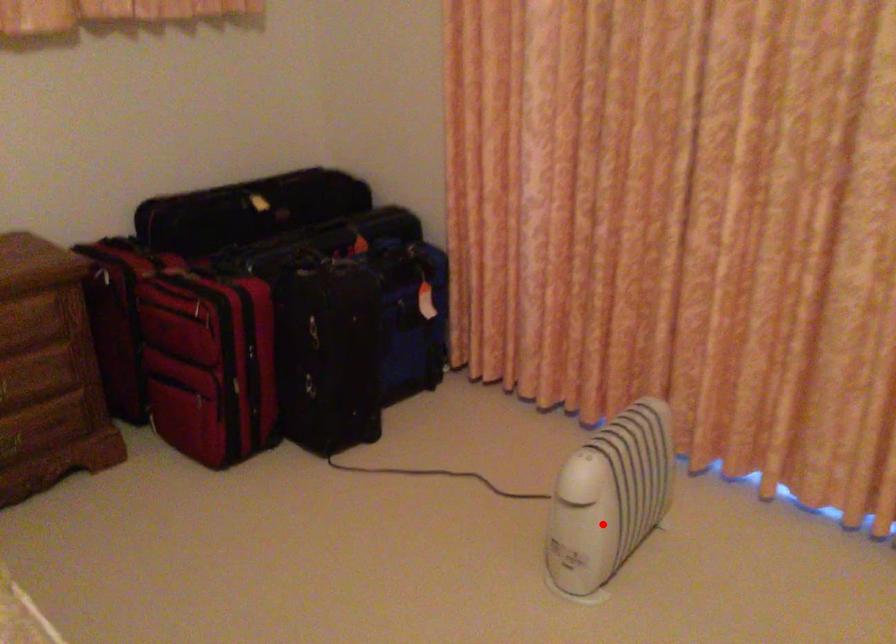
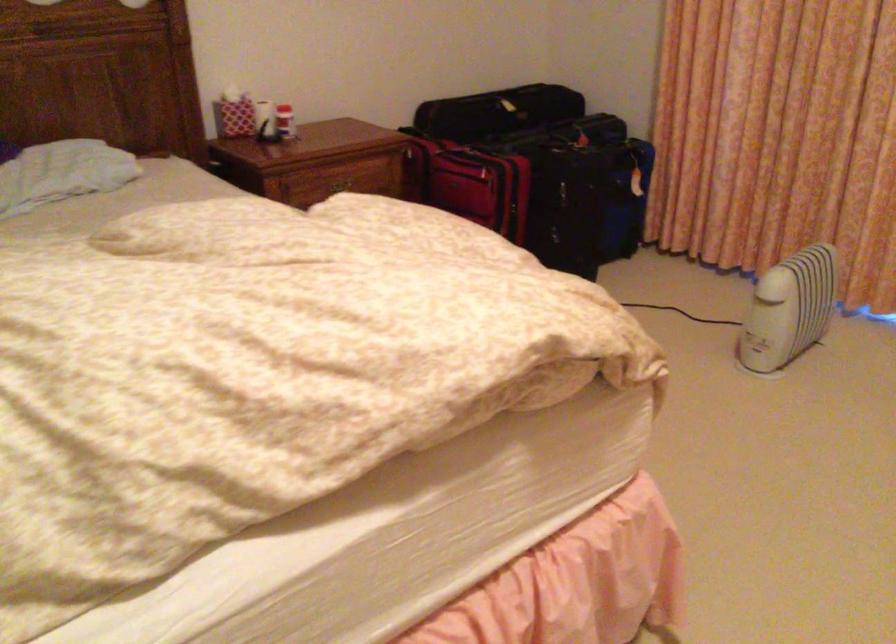
Find the pixel in the second image that matches the highlighted location in the first image.

(789, 308)